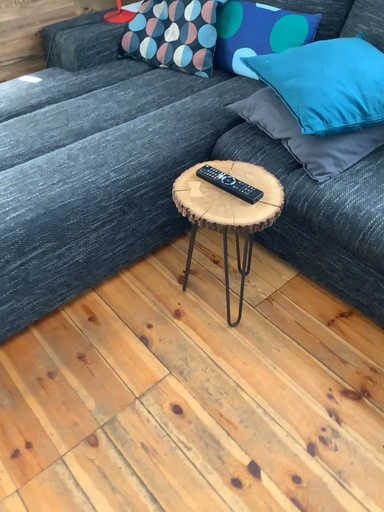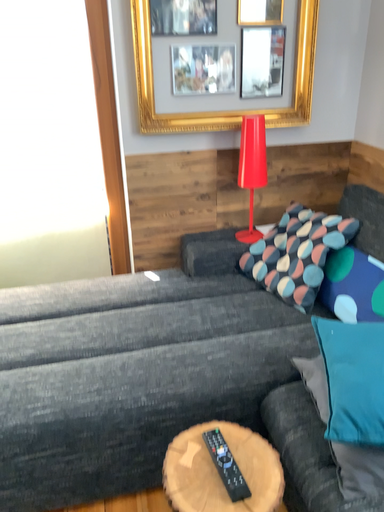
Question: Which way did the camera rotate in the video?

Choices:
 (A) rotated upward
 (B) rotated downward

Answer: (A)